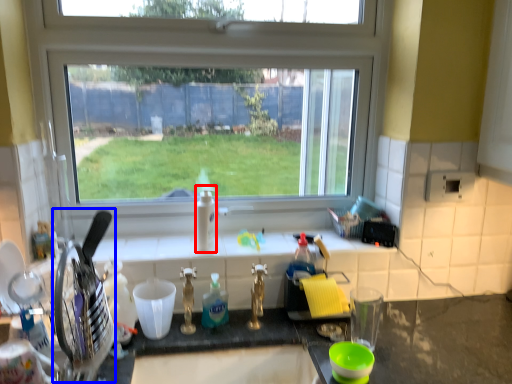
Question: Which object appears farthest to the camera in this image, bottle (highlighted by a red box) or appliance (highlighted by a blue box)?

Choices:
 (A) bottle
 (B) appliance

Answer: (A)